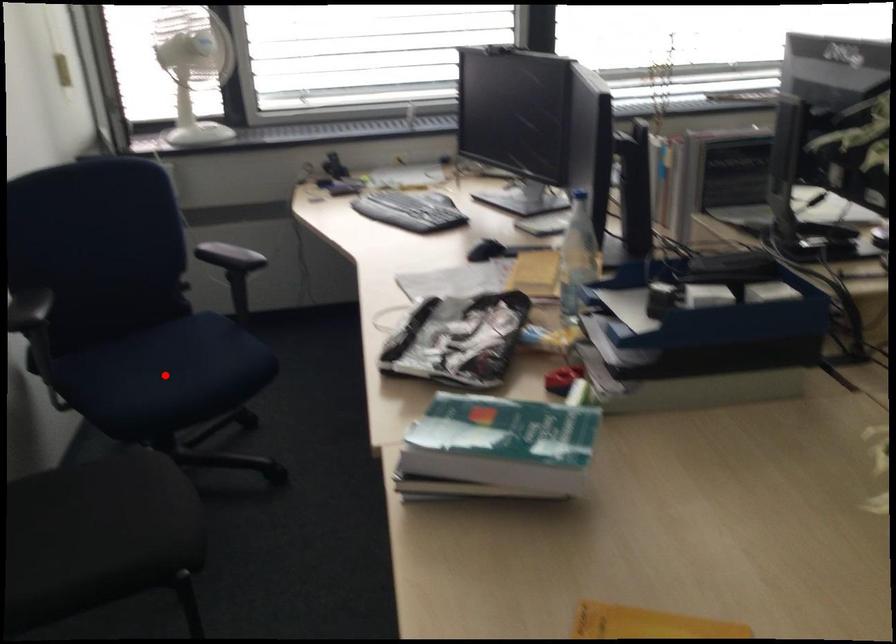
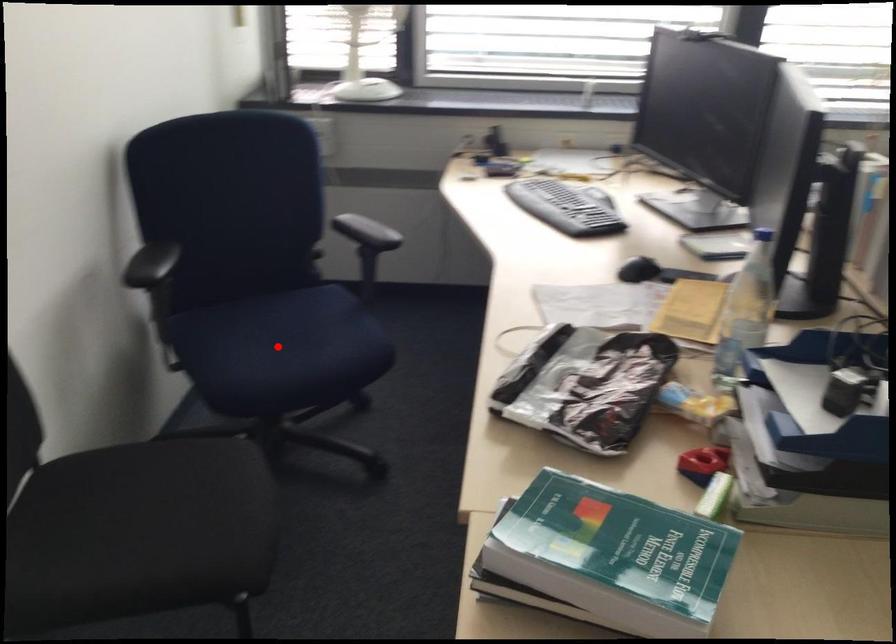
I am providing you with two images of the same scene from different viewpoints. A red point is marked on the first image and another point is marked on the second image. Does the point marked in image1 correspond to the same location as the one in image2?

Yes